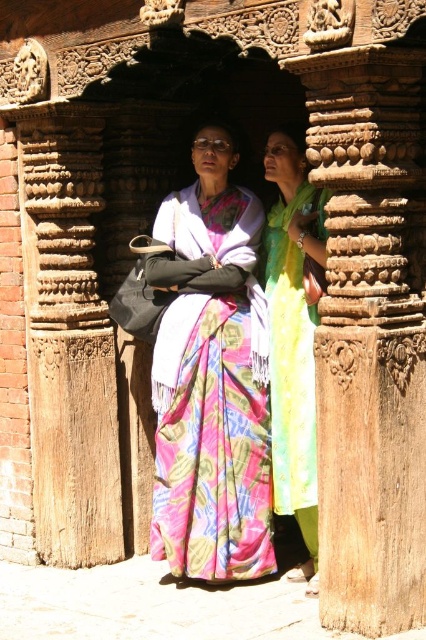
You are a photographer setting up a shot in front of the doorway. You need to position both the printed silk sari at center and the green silk dress at center so that they fit within a 2.5 meter wide frame. Can both items fit side by side without overlapping?

The printed silk sari at center might be wider than green silk dress at center. If the sari is wider, the combined width of both items could exceed 2.5 meters. Therefore, it depends on the exact widths, but there is a possibility they might not fit side by side without overlapping.